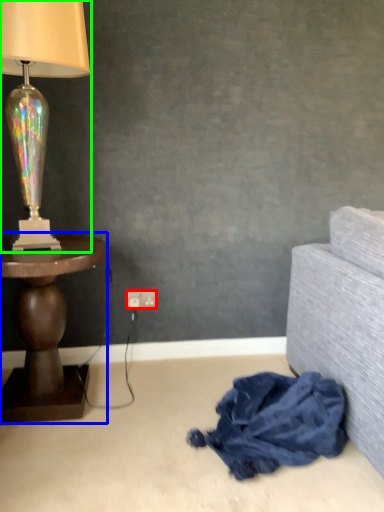
Question: Which is farther away from power outlet (highlighted by a red box)? table (highlighted by a blue box) or lamp (highlighted by a green box)?

Choices:
 (A) table
 (B) lamp

Answer: (B)